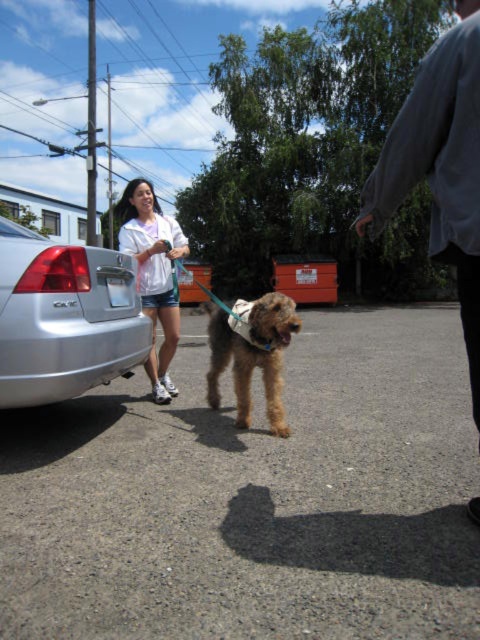
Does point (29, 346) come closer to viewer compared to point (282, 412)?

Yes, it is.

Who is higher up, silver metallic car at lower left or fuzzy brown dog at center?

silver metallic car at lower left is above.

The width and height of the screenshot is (480, 640). Find the location of `silver metallic car at lower left`. silver metallic car at lower left is located at coordinates (64, 317).

Does gray fabric shirt at upper right have a greater width compared to fuzzy brown dog at center?

Correct, the width of gray fabric shirt at upper right exceeds that of fuzzy brown dog at center.

Is point (448, 186) closer to camera compared to point (261, 349)?

That is True.

Image resolution: width=480 pixels, height=640 pixels. I want to click on gray fabric shirt at upper right, so click(441, 166).

Can you confirm if silver metallic car at lower left is positioned to the right of white fabric jacket at upper center?

→ Correct, you'll find silver metallic car at lower left to the right of white fabric jacket at upper center.

This screenshot has height=640, width=480. Identify the location of silver metallic car at lower left. (64, 317).